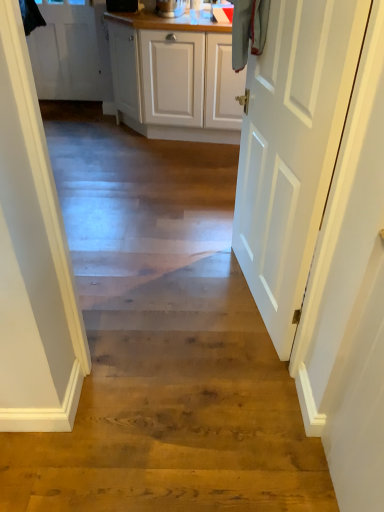
At what (x,y) coordinates should I click in order to perform the action: click on white matte door at right, the 1th door viewed from the front. Please return your answer as a coordinate pair (x, y). Image resolution: width=384 pixels, height=512 pixels. Looking at the image, I should click on (292, 149).

What is the approximate width of white matte door at right, which ranks as the second door in left-to-right order?

It is 6.26 inches.

Describe the element at coordinates (292, 149) in the screenshot. The width and height of the screenshot is (384, 512). I see `white matte door at right, which appears as the second door when viewed from the top` at that location.

Describe the element at coordinates (71, 52) in the screenshot. I see `white matte door at upper left, which is counted as the 1th door, starting from the left` at that location.

In order to face white matte door at upper left, which ranks as the first door in top-to-bottom order, should I rotate leftwards or rightwards?

Rotate your view left by about 16.785°.

I want to click on white matte door at upper left, arranged as the second door when viewed from the front, so click(71, 52).

Locate an element on the screen. The width and height of the screenshot is (384, 512). white matte door at right, the first door ordered from the bottom is located at coordinates click(x=292, y=149).

Considering the positions of objects white matte door at upper left, arranged as the second door when viewed from the front, and white matte door at right, acting as the second door starting from the back, in the image provided, who is more to the left, white matte door at upper left, arranged as the second door when viewed from the front, or white matte door at right, acting as the second door starting from the back,?

white matte door at upper left, arranged as the second door when viewed from the front.

Which is behind, white matte door at upper left, arranged as the second door when viewed from the front, or white matte door at right, the 1th door viewed from the front?

white matte door at upper left, arranged as the second door when viewed from the front, is more distant.

Is point (61, 13) positioned after point (356, 14)?

Yes, point (61, 13) is farther from viewer.

Consider the image. From the image's perspective, which is above, white matte door at upper left, which is counted as the 2th door, starting from the right, or white matte door at right, the 1th door viewed from the front?

white matte door at upper left, which is counted as the 2th door, starting from the right, is shown above in the image.

From a real-world perspective, between white matte door at upper left, which is the second door in bottom-to-top order, and white matte door at right, which ranks as the second door in left-to-right order, who is vertically lower?

white matte door at upper left, which is the second door in bottom-to-top order, from a real-world perspective.

Is white matte door at upper left, marked as the first door in a back-to-front arrangement, wider than white matte door at right, which ranks as the second door in left-to-right order?

Incorrect, the width of white matte door at upper left, marked as the first door in a back-to-front arrangement, does not surpass that of white matte door at right, which ranks as the second door in left-to-right order.

Does white matte door at upper left, which ranks as the first door in top-to-bottom order, have a lesser height compared to white matte door at right, which is the 1th door in right-to-left order?

Yes.

Based on their sizes in the image, would you say white matte door at upper left, which is the second door in bottom-to-top order, is bigger or smaller than white matte door at right, the first door ordered from the bottom?

In the image, white matte door at upper left, which is the second door in bottom-to-top order, appears to be smaller than white matte door at right, the first door ordered from the bottom.

Does white matte door at upper left, arranged as the second door when viewed from the front, contain white matte door at right, which appears as the second door when viewed from the top?

No, white matte door at right, which appears as the second door when viewed from the top, is located outside of white matte door at upper left, arranged as the second door when viewed from the front.

Is white matte door at upper left, which is the second door in bottom-to-top order, not near white matte door at right, which ranks as the second door in left-to-right order?

Indeed, white matte door at upper left, which is the second door in bottom-to-top order, is not near white matte door at right, which ranks as the second door in left-to-right order.

Does white matte door at upper left, arranged as the second door when viewed from the front, turn towards white matte door at right, the first door ordered from the bottom?

No, white matte door at upper left, arranged as the second door when viewed from the front, is not oriented towards white matte door at right, the first door ordered from the bottom.

Locate an element on the screen. door above the white matte door at right, acting as the second door starting from the back (from the image's perspective) is located at coordinates (71, 52).

Is white matte door at right, the first door ordered from the bottom, to the right of white matte door at upper left, which ranks as the first door in top-to-bottom order, from the viewer's perspective?

Yes, white matte door at right, the first door ordered from the bottom, is to the right of white matte door at upper left, which ranks as the first door in top-to-bottom order.

Is white matte door at right, which appears as the second door when viewed from the top, further to camera compared to white matte door at upper left, which ranks as the first door in top-to-bottom order?

No, white matte door at right, which appears as the second door when viewed from the top, is in front of white matte door at upper left, which ranks as the first door in top-to-bottom order.

Is point (356, 42) farther from camera compared to point (95, 20)?

No.

From the image's perspective, is white matte door at right, which appears as the second door when viewed from the top, above or below white matte door at upper left, which is the second door in bottom-to-top order?

Based on their image positions, white matte door at right, which appears as the second door when viewed from the top, is located beneath white matte door at upper left, which is the second door in bottom-to-top order.

From a real-world perspective, does white matte door at right, acting as the second door starting from the back, stand above white matte door at upper left, which is counted as the 1th door, starting from the left?

Indeed, from a real-world perspective, white matte door at right, acting as the second door starting from the back, stands above white matte door at upper left, which is counted as the 1th door, starting from the left.

Which of these two, white matte door at right, which ranks as the second door in left-to-right order, or white matte door at upper left, which ranks as the first door in top-to-bottom order, is thinner?

Thinner between the two is white matte door at upper left, which ranks as the first door in top-to-bottom order.

Between white matte door at right, acting as the second door starting from the back, and white matte door at upper left, which is the second door in bottom-to-top order, which one has less height?

Standing shorter between the two is white matte door at upper left, which is the second door in bottom-to-top order.

Looking at the image, does white matte door at right, which appears as the second door when viewed from the top, seem bigger or smaller compared to white matte door at upper left, arranged as the second door when viewed from the front?

In the image, white matte door at right, which appears as the second door when viewed from the top, appears to be larger than white matte door at upper left, arranged as the second door when viewed from the front.

Is white matte door at right, the first door ordered from the bottom, inside the boundaries of white matte door at upper left, which is counted as the 2th door, starting from the right, or outside?

white matte door at right, the first door ordered from the bottom, is not inside white matte door at upper left, which is counted as the 2th door, starting from the right, it's outside.

Are white matte door at right, the 1th door viewed from the front, and white matte door at upper left, which is counted as the 1th door, starting from the left, far apart?

Yes.

Is white matte door at right, which ranks as the second door in left-to-right order, positioned with its back to white matte door at upper left, arranged as the second door when viewed from the front?

No, white matte door at upper left, arranged as the second door when viewed from the front, is not at the back of white matte door at right, which ranks as the second door in left-to-right order.

Find the location of a particular element. Image resolution: width=384 pixels, height=512 pixels. door below the white matte door at upper left, marked as the first door in a back-to-front arrangement (from the image's perspective) is located at coordinates pos(292,149).

The width and height of the screenshot is (384, 512). Identify the location of door on the right of the white matte door at upper left, arranged as the second door when viewed from the front. (292, 149).

In the image, there is a white matte door at right, which ranks as the second door in left-to-right order. At what (x,y) coordinates should I click in order to perform the action: click on door below it (from a real-world perspective). Please return your answer as a coordinate pair (x, y). Looking at the image, I should click on (71, 52).